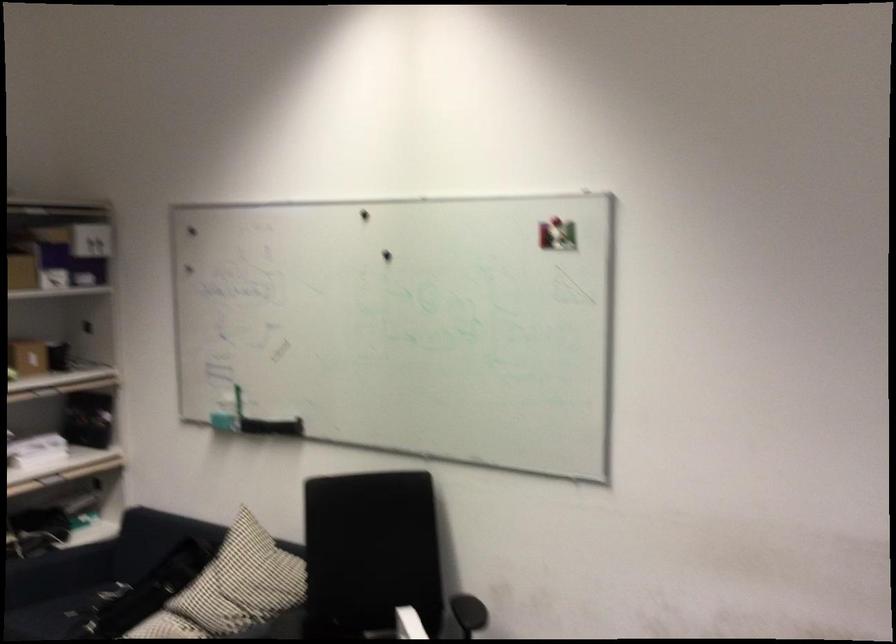
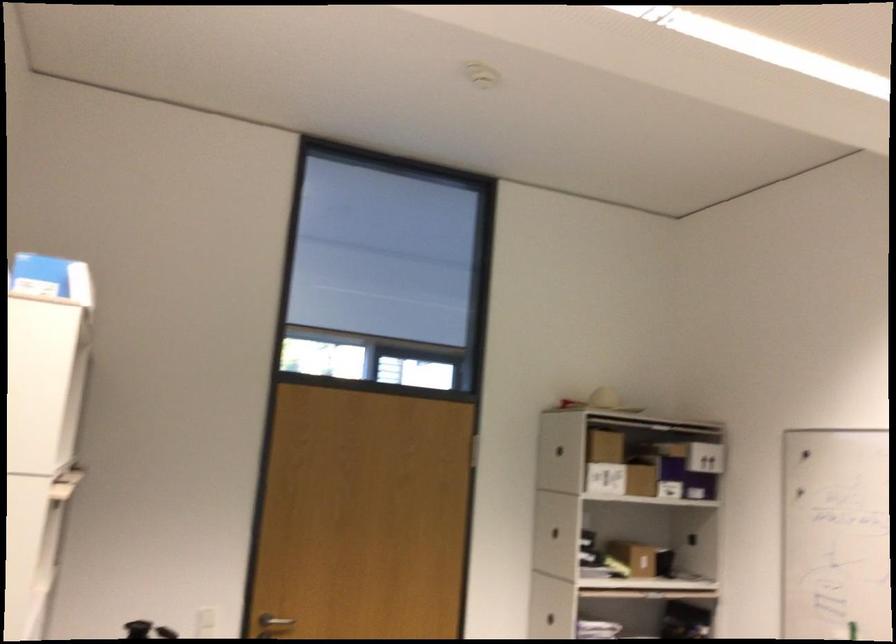
Question: The camera is either moving clockwise (left) or counter-clockwise (right) around the object. The first image is from the beginning of the video and the second image is from the end. Is the camera moving left or right when shooting the video?

Choices:
 (A) Left
 (B) Right

Answer: (B)